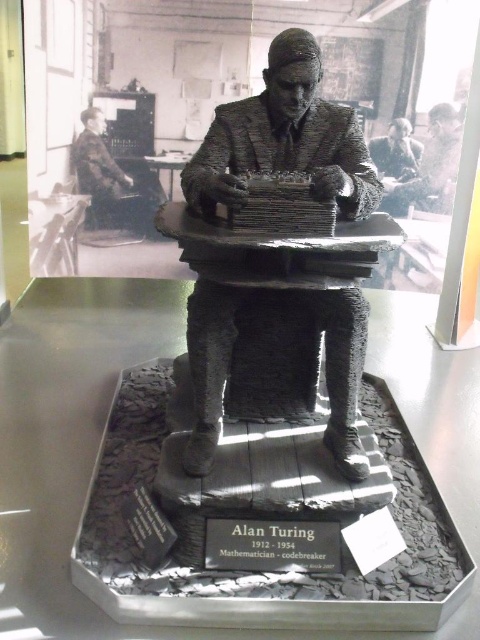
Is black stone plaque at center positioned before camouflage fabric jacket at upper left?

That is True.

Between black stone plaque at center and camouflage fabric jacket at upper left, which one has less height?

Standing shorter between the two is black stone plaque at center.

This screenshot has width=480, height=640. Find the location of `black stone plaque at center`. black stone plaque at center is located at coordinates (272, 545).

Who is higher up, bronze textured statue at center or black stone plaque at center?

bronze textured statue at center

Which is in front, point (226, 262) or point (277, 536)?

Point (226, 262)

Is point (224, 380) more distant than point (298, 522)?

Yes.

Identify the location of bronze textured statue at center. (273, 349).

How distant is bronze textured statue at center from camouflage fabric jacket at upper left?

bronze textured statue at center is 5.60 feet away from camouflage fabric jacket at upper left.

Who is shorter, bronze textured statue at center or camouflage fabric jacket at upper left?

camouflage fabric jacket at upper left is shorter.

Is point (274, 296) farther from viewer compared to point (74, 150)?

No, it is in front of (74, 150).

This screenshot has width=480, height=640. In order to click on bronze textured statue at center in this screenshot , I will do `click(273, 349)`.